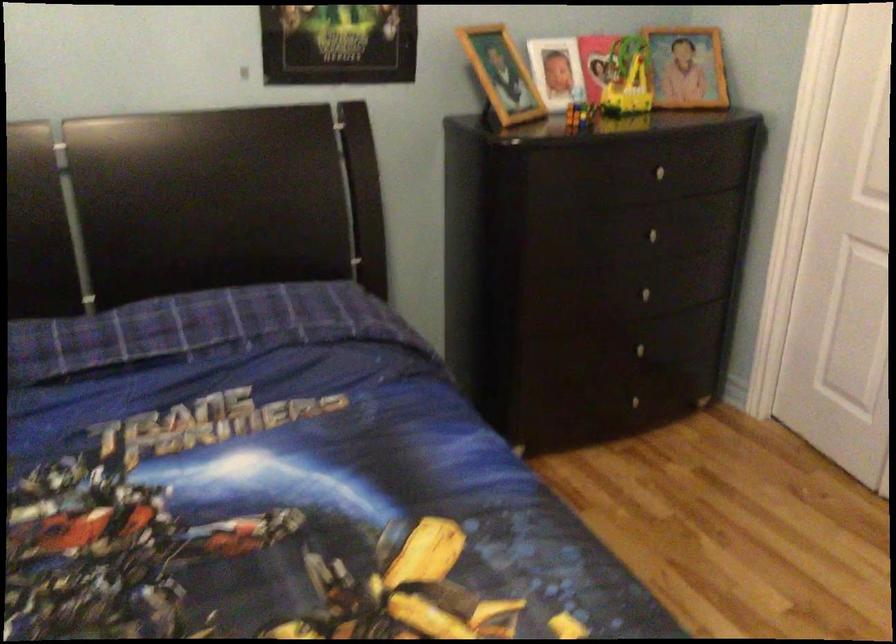
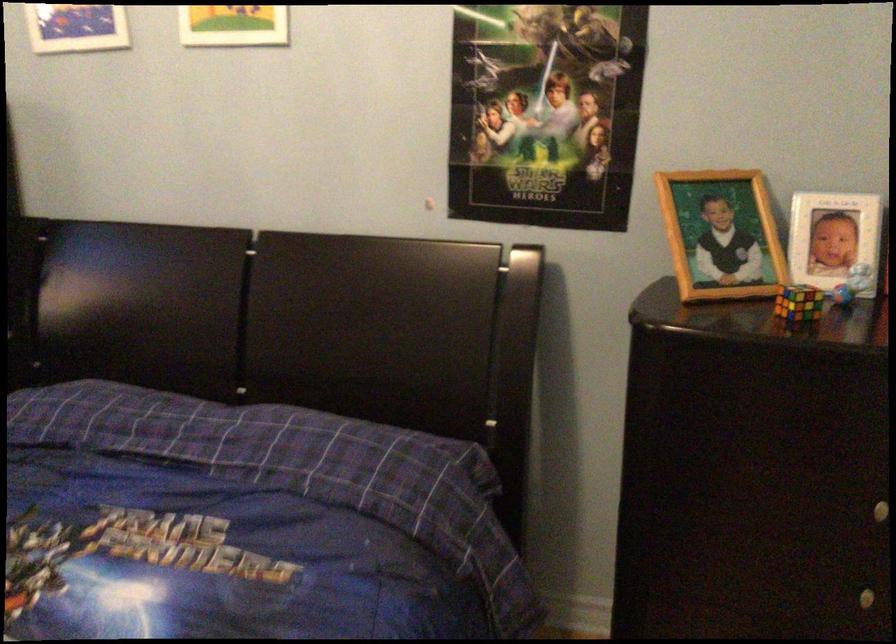
Find the pixel in the second image that matches point 649,292 in the first image.

(868, 597)